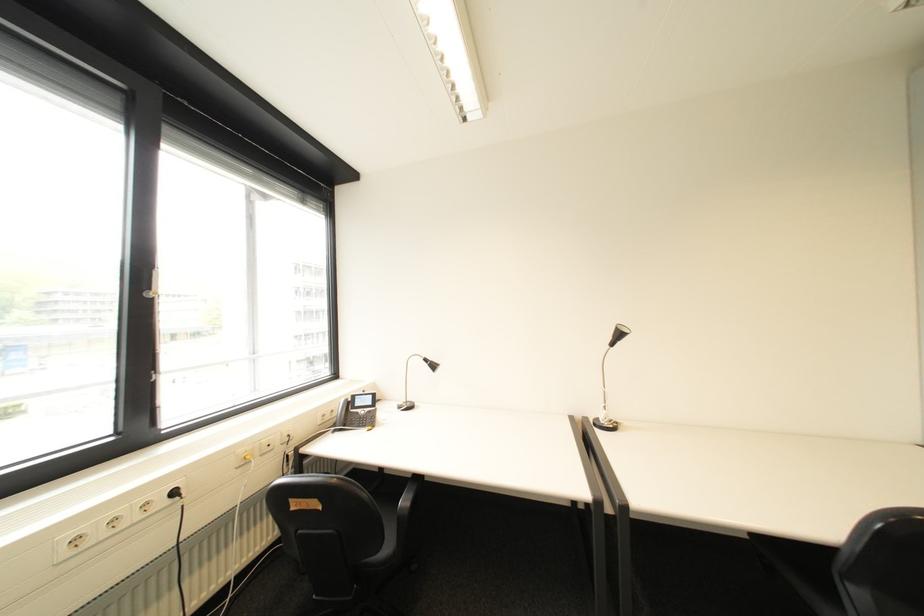
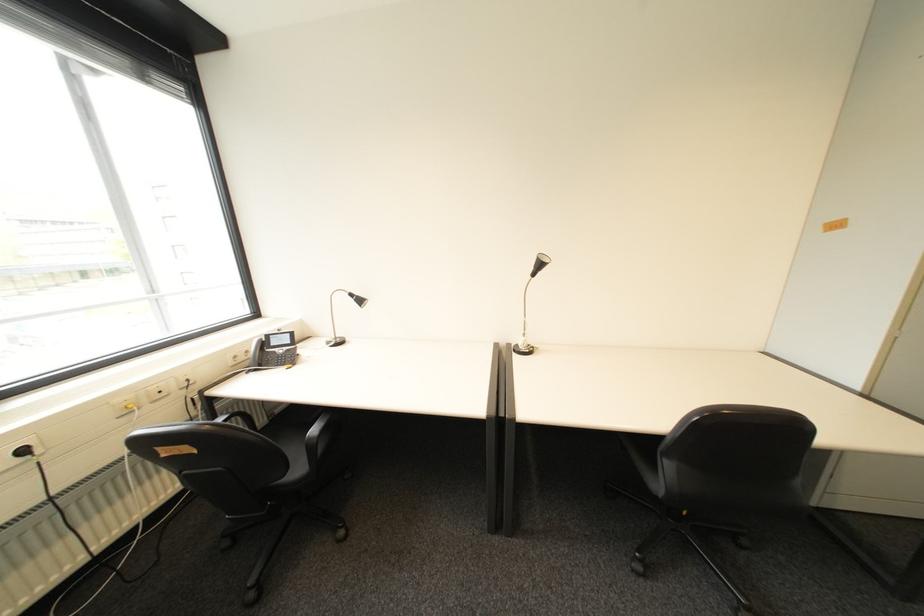
The point at (608, 419) is marked in the first image. Where is the corresponding point in the second image?

(528, 345)